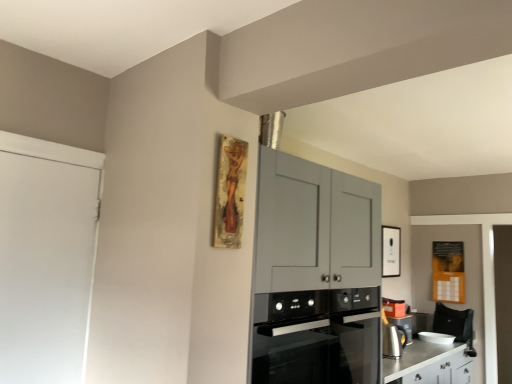
The width and height of the screenshot is (512, 384). Identify the location of blank space above white matte door at left (from a real-world perspective). (50, 158).